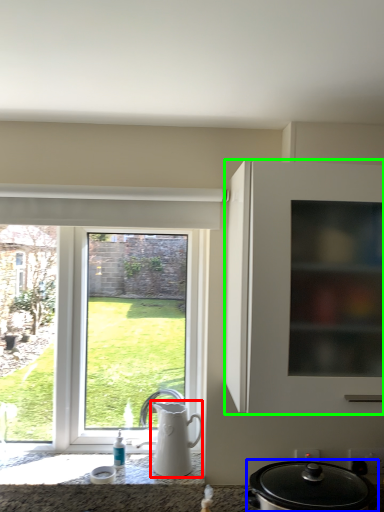
Question: Which object is positioned closest to jug (highlighted by a red box)? Select from kitchen appliance (highlighted by a blue box) and cabinetry (highlighted by a green box).

Choices:
 (A) kitchen appliance
 (B) cabinetry

Answer: (A)